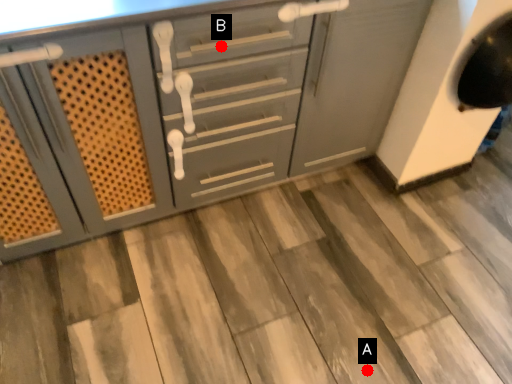
Question: Two points are circled on the image, labeled by A and B beside each circle. Which point is closer to the camera?

Choices:
 (A) A is closer
 (B) B is closer

Answer: (B)